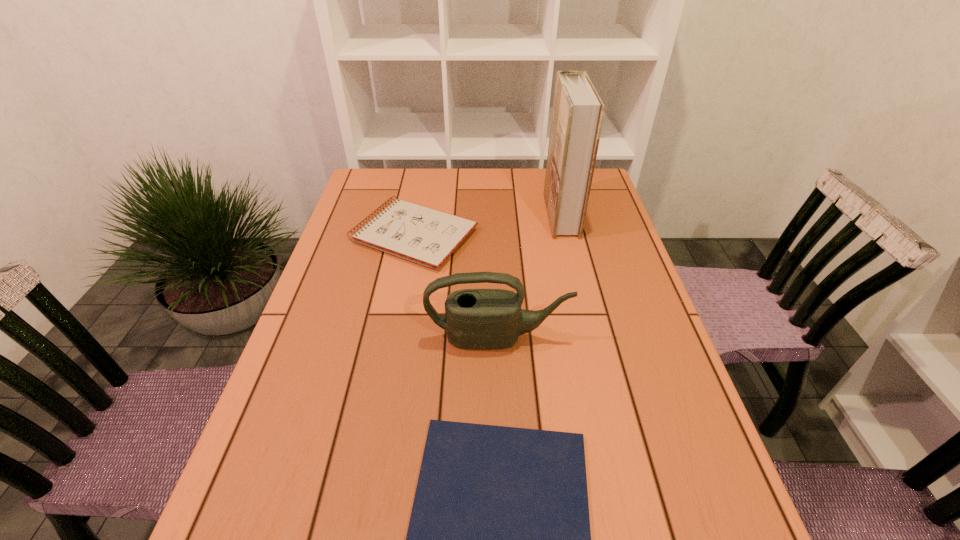
Locate an element on the screen. vacant space at the far left corner is located at coordinates (358, 192).

You are a GUI agent. You are given a task and a screenshot of the screen. Output one action in this format:
    pyautogui.click(x=<x>, y=<y>)
    Task: Click on the free space at the far right corner
    The image size is (960, 540).
    Given the screenshot: What is the action you would take?
    pyautogui.click(x=609, y=197)

Where is `vacant point located between the rightmost object and the taller notepad`? vacant point located between the rightmost object and the taller notepad is located at coordinates (488, 225).

This screenshot has height=540, width=960. I want to click on free space between the third shortest object and the farther notepad, so click(456, 287).

What are the coordinates of `free space between the taller notepad and the phonebook` in the screenshot? It's located at click(488, 225).

This screenshot has width=960, height=540. Find the location of `vacant area that lies between the tallest object and the watering can`. vacant area that lies between the tallest object and the watering can is located at coordinates (529, 276).

At what (x,y) coordinates should I click in order to perform the action: click on object that is the third nearest to the shortest object. Please return your answer as a coordinate pair (x, y). The width and height of the screenshot is (960, 540). Looking at the image, I should click on (578, 111).

Image resolution: width=960 pixels, height=540 pixels. I want to click on the third closest object to the third shortest object, so click(x=578, y=111).

In order to click on free location that satisfies the following two spatial constraints: 1. on the cover of the rightmost object; 2. on the front side of the farther notepad in this screenshot , I will do `click(566, 235)`.

This screenshot has height=540, width=960. What are the coordinates of `vacant space that satisfies the following two spatial constraints: 1. on the cover of the phonebook; 2. on the front side of the third tallest object` in the screenshot? It's located at (566, 235).